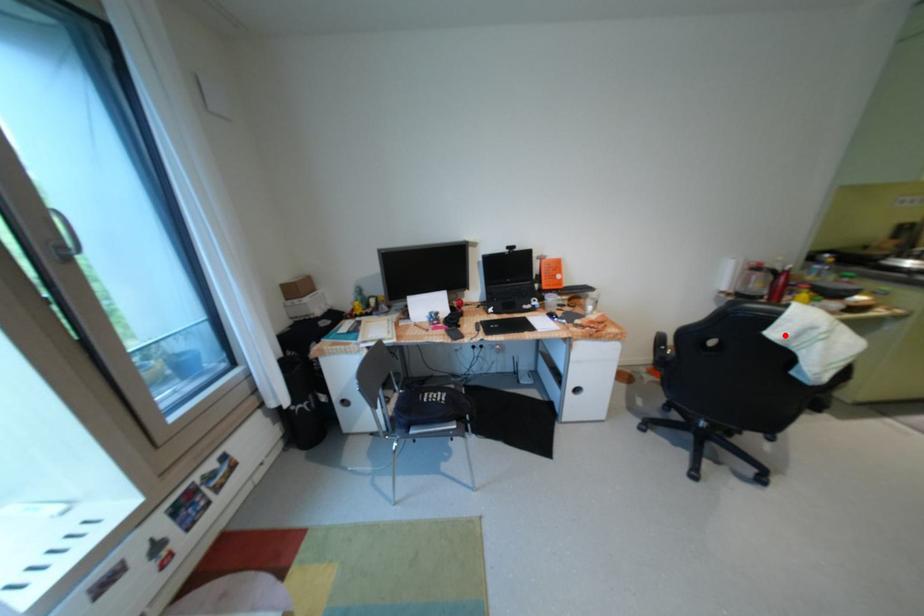
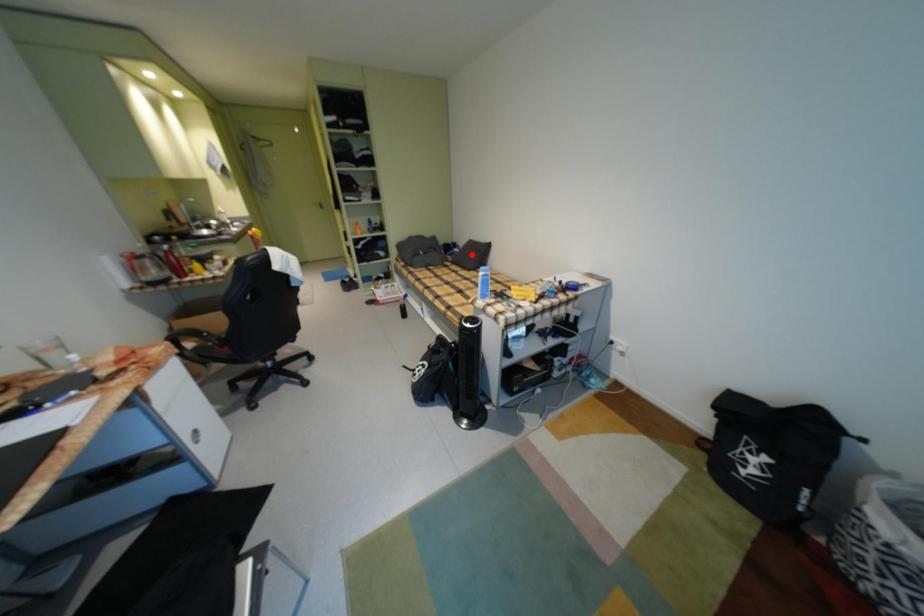
I am providing you with two images of the same scene from different viewpoints. A red point is marked on the first image and another point is marked on the second image. Do the highlighted points in image1 and image2 indicate the same real-world spot?

No